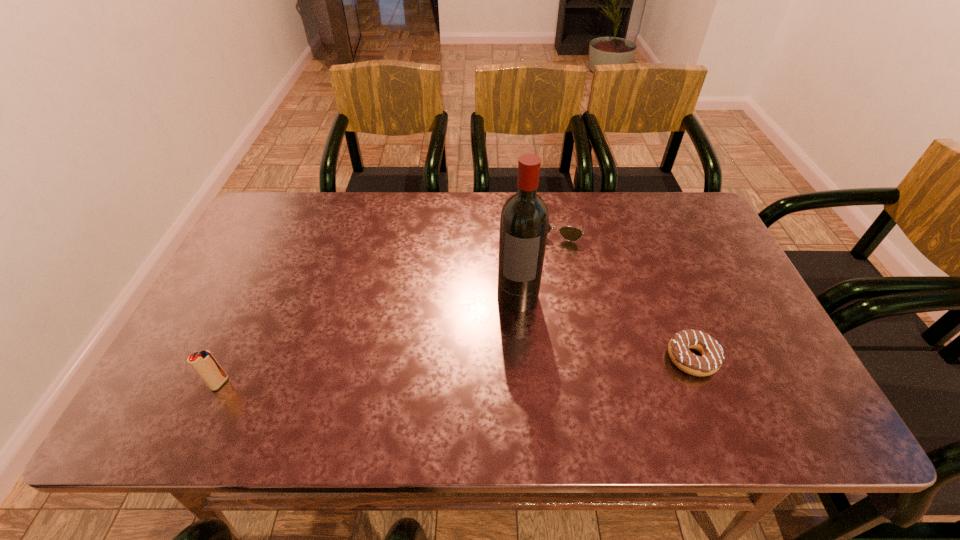
Locate an element on the screen. vacant space located 0.080m on the label of the wine bottle is located at coordinates (513, 337).

You are a GUI agent. You are given a task and a screenshot of the screen. Output one action in this format:
    pyautogui.click(x=<x>, y=<y>)
    Task: Click on the vacant space located on the label of the wine bottle
    The image size is (960, 540).
    Given the screenshot: What is the action you would take?
    pyautogui.click(x=511, y=354)

Locate an element on the screen. free spot located on the label of the wine bottle is located at coordinates (511, 354).

The width and height of the screenshot is (960, 540). What are the coordinates of `free spot located 0.120m on the front-facing side of the farthest object` in the screenshot? It's located at (545, 270).

I want to click on free location located on the front-facing side of the farthest object, so click(533, 315).

This screenshot has height=540, width=960. I want to click on vacant space located on the front-facing side of the farthest object, so click(532, 321).

You are a GUI agent. You are given a task and a screenshot of the screen. Output one action in this format:
    pyautogui.click(x=<x>, y=<y>)
    Task: Click on the object that is at the far edge
    This screenshot has height=540, width=960.
    Given the screenshot: What is the action you would take?
    pyautogui.click(x=569, y=233)

Locate an element on the screen. The width and height of the screenshot is (960, 540). igniter situated at the near edge is located at coordinates (205, 365).

Identify the location of doughnut that is positioned at the near edge. (712, 357).

The width and height of the screenshot is (960, 540). I want to click on object that is positioned at the left edge, so click(x=205, y=365).